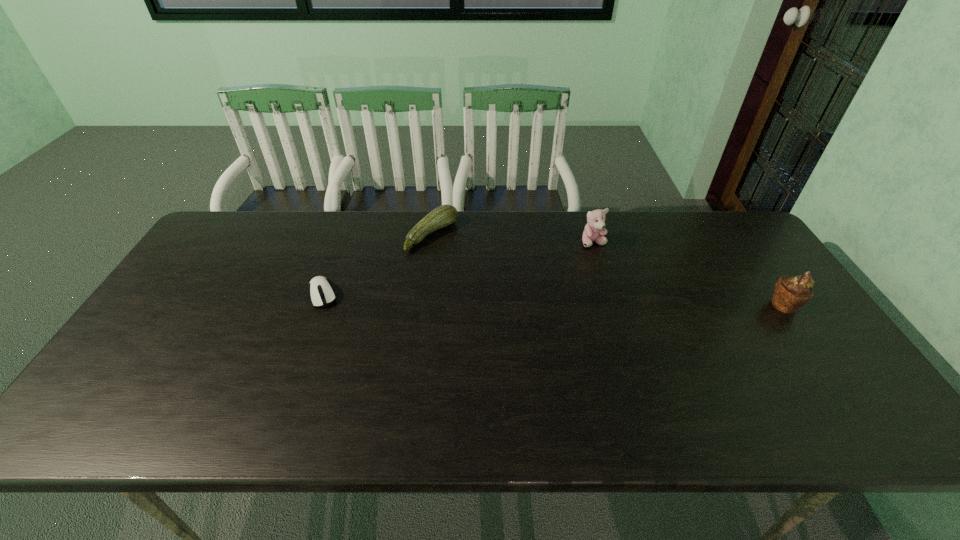
In the image, there is a desktop. Identify the location of free space at the right edge. Image resolution: width=960 pixels, height=540 pixels. (796, 320).

Where is `vacant space at the far left corner`? vacant space at the far left corner is located at coordinates (203, 246).

The image size is (960, 540). In order to click on free region at the far right corner of the desktop in this screenshot , I will do `click(716, 248)`.

Locate an element on the screen. free space at the near right corner of the desktop is located at coordinates (790, 367).

This screenshot has width=960, height=540. What are the coordinates of `free area in between the zucchini and the muffin` in the screenshot? It's located at (609, 270).

Locate an element on the screen. empty space that is in between the second shortest object and the rightmost object is located at coordinates (609, 270).

Locate an element on the screen. This screenshot has height=540, width=960. vacant area between the leftmost object and the rightmost object is located at coordinates (554, 300).

Locate an element on the screen. empty location between the teddy bear and the second object from left to right is located at coordinates (513, 239).

Where is `free space that is in between the rightmost object and the third object from right to left`? free space that is in between the rightmost object and the third object from right to left is located at coordinates (609, 270).

Locate an element on the screen. empty location between the teddy bear and the muffin is located at coordinates (689, 274).